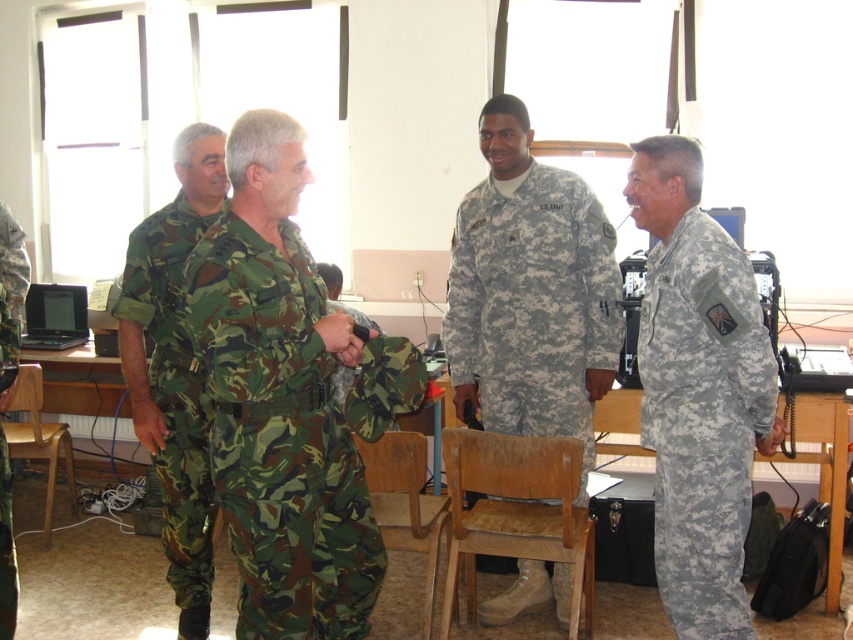
Can you confirm if camouflage uniform at center is positioned to the left of camouflage fabric uniform at right?

Yes, camouflage uniform at center is to the left of camouflage fabric uniform at right.

Is camouflage uniform at center taller than camouflage fabric uniform at right?

Yes.

The image size is (853, 640). What are the coordinates of `camouflage uniform at center` in the screenshot? It's located at (531, 292).

Is point (297, 262) closer to viewer compared to point (33, 458)?

Yes, point (297, 262) is closer to viewer.

Who is taller, camo fabric uniform at center or wooden chair at lower left?

Standing taller between the two is camo fabric uniform at center.

Who is more forward, (x=349, y=513) or (x=48, y=532)?

Point (x=349, y=513) is more forward.

Find the location of a particular element. Image resolution: width=853 pixels, height=640 pixels. camo fabric uniform at center is located at coordinates (280, 436).

Does camo fabric uniform at center have a lesser height compared to camouflage fabric uniform at left?

Yes, camo fabric uniform at center is shorter than camouflage fabric uniform at left.

Does camo fabric uniform at center have a greater width compared to camouflage fabric uniform at left?

Yes.

What do you see at coordinates (280, 436) in the screenshot? I see `camo fabric uniform at center` at bounding box center [280, 436].

The width and height of the screenshot is (853, 640). In order to click on camo fabric uniform at center in this screenshot , I will do `click(280, 436)`.